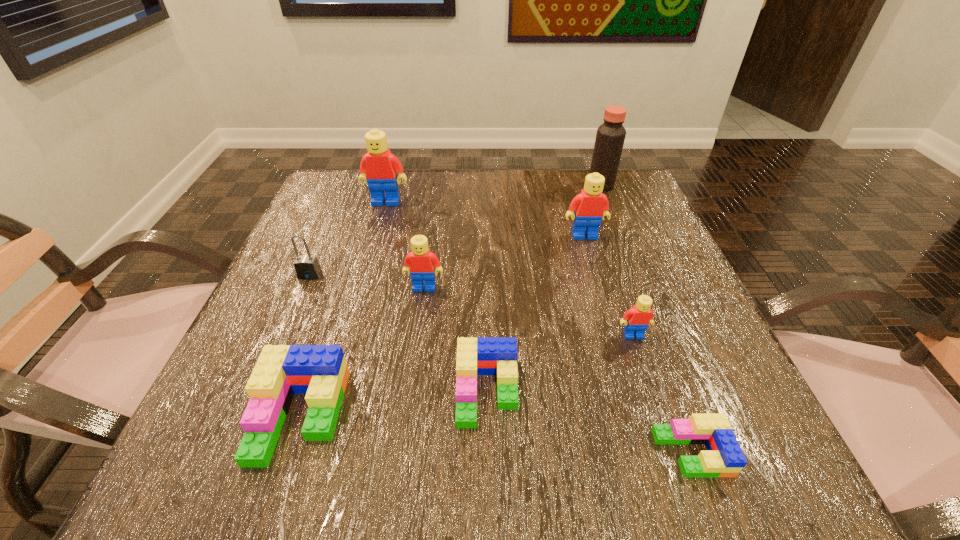
You are a GUI agent. You are given a task and a screenshot of the screen. Output one action in this format:
    pyautogui.click(x=<x>, y=<y>)
    Task: Click on the vacant space that is in between the padlock and the second farthest red Lego
    Image resolution: width=960 pixels, height=540 pixels.
    Given the screenshot: What is the action you would take?
    pyautogui.click(x=447, y=255)

Locate which object is the second closest to the sixth shortest Lego. Please provide its 2D coordinates. Your answer should be formatted as a tuple, i.e. [(x, y)], where the tuple contains the x and y coordinates of a point satisfying the conditions above.

[(637, 319)]

Select which object is the fifth closest to the second biggest green Lego. Please provide its 2D coordinates. Your answer should be formatted as a tuple, i.e. [(x, y)], where the tuple contains the x and y coordinates of a point satisfying the conditions above.

[(307, 267)]

Identify which Lego is the third nearest to the padlock. Please provide its 2D coordinates. Your answer should be formatted as a tuple, i.e. [(x, y)], where the tuple contains the x and y coordinates of a point satisfying the conditions above.

[(379, 168)]

Identify the location of Lego object that ranks as the fifth closest to the shortest object. (320, 371).

You are a GUI agent. You are given a task and a screenshot of the screen. Output one action in this format:
    pyautogui.click(x=<x>, y=<y>)
    Task: Click on the red Lego that is the fourth closest to the vinegar
    
    Given the screenshot: What is the action you would take?
    pyautogui.click(x=422, y=261)

Locate which red Lego ranks in proximity to the tallest Lego. Please provide its 2D coordinates. Your answer should be formatted as a tuple, i.e. [(x, y)], where the tuple contains the x and y coordinates of a point satisfying the conditions above.

[(422, 261)]

The height and width of the screenshot is (540, 960). Identify the location of the second closest green Lego relative to the sixth shortest Lego. (724, 457).

At what (x,y) coordinates should I click in order to perform the action: click on the second closest green Lego to the fifth shortest Lego. Please return your answer as a coordinate pair (x, y). This screenshot has height=540, width=960. Looking at the image, I should click on [x=320, y=371].

Find the location of a particular element. The width and height of the screenshot is (960, 540). free space that satisfies the following two spatial constraints: 1. on the face of the shortest object; 2. on the right side of the fourth farthest Lego is located at coordinates (673, 453).